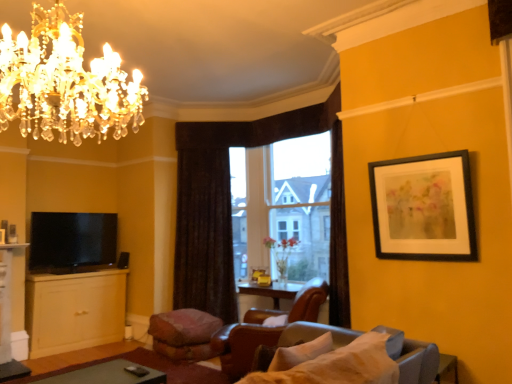
Question: Does dark brown textured curtain at center have a larger size compared to transparent glass window at center?

Choices:
 (A) no
 (B) yes

Answer: (A)

Question: From the image's perspective, is dark brown textured curtain at center on transparent glass window at center?

Choices:
 (A) yes
 (B) no

Answer: (B)

Question: Is dark brown textured curtain at center positioned in front of transparent glass window at center?

Choices:
 (A) no
 (B) yes

Answer: (A)

Question: From the image's perspective, would you say dark brown textured curtain at center is shown under transparent glass window at center?

Choices:
 (A) no
 (B) yes

Answer: (B)

Question: Considering the relative sizes of dark brown textured curtain at center and transparent glass window at center in the image provided, is dark brown textured curtain at center shorter than transparent glass window at center?

Choices:
 (A) no
 (B) yes

Answer: (A)

Question: Does point (101, 369) appear closer or farther from the camera than point (203, 347)?

Choices:
 (A) farther
 (B) closer

Answer: (A)

Question: Considering their positions, is green matte table at lower left located in front of or behind pink fabric footrest at lower center?

Choices:
 (A) front
 (B) behind

Answer: (A)

Question: In terms of height, does green matte table at lower left look taller or shorter compared to pink fabric footrest at lower center?

Choices:
 (A) tall
 (B) short

Answer: (B)

Question: Based on their sizes in the image, would you say green matte table at lower left is bigger or smaller than pink fabric footrest at lower center?

Choices:
 (A) big
 (B) small

Answer: (B)

Question: Is green matte table at lower left inside or outside of transparent glass window at center?

Choices:
 (A) outside
 (B) inside

Answer: (A)

Question: Based on their sizes in the image, would you say green matte table at lower left is bigger or smaller than transparent glass window at center?

Choices:
 (A) big
 (B) small

Answer: (B)

Question: Relative to transparent glass window at center, is green matte table at lower left in front or behind?

Choices:
 (A) behind
 (B) front

Answer: (B)

Question: In terms of width, does green matte table at lower left look wider or thinner when compared to transparent glass window at center?

Choices:
 (A) thin
 (B) wide

Answer: (B)

Question: Considering their positions, is matte yellow cabinet at lower left located in front of or behind matte black tv at lower left?

Choices:
 (A) behind
 (B) front

Answer: (B)

Question: In the image, is matte yellow cabinet at lower left on the left side or the right side of matte black tv at lower left?

Choices:
 (A) left
 (B) right

Answer: (A)